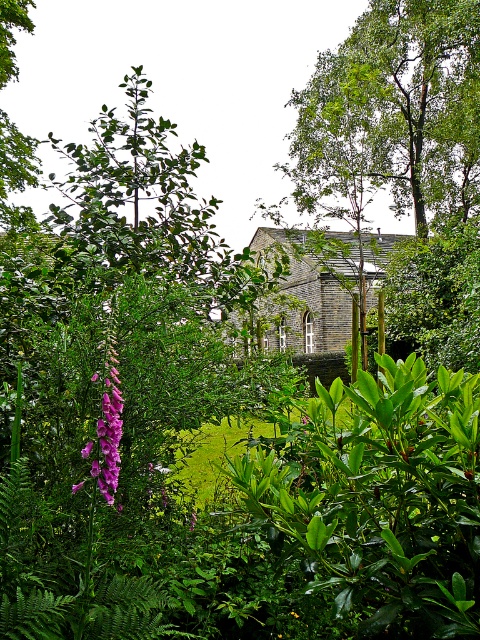
You are a gardener who needs to water the green glossy bush at center and the purple silky flower at left. The watering can you have can only reach 30 inches. Can you water both plants without moving the watering can?

The green glossy bush at center is 34.88 inches from the purple silky flower at left, which is beyond the watering can reach of 30 inches. Therefore, you cannot water both plants without moving the watering can.

You are planning to plant a new garden and want to know which of the two plants, the green glossy bush at center or the purple silky flower at left, requires more space. Based on the image, which one would you choose?

The green glossy bush at center is larger in size than the purple silky flower at left, so it requires more space and would be the one to choose for needing more area.